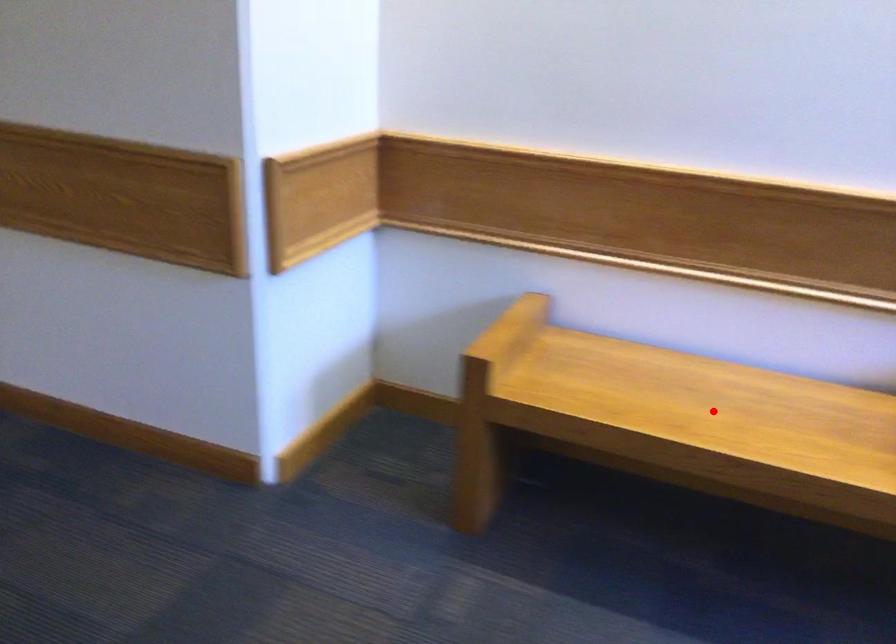
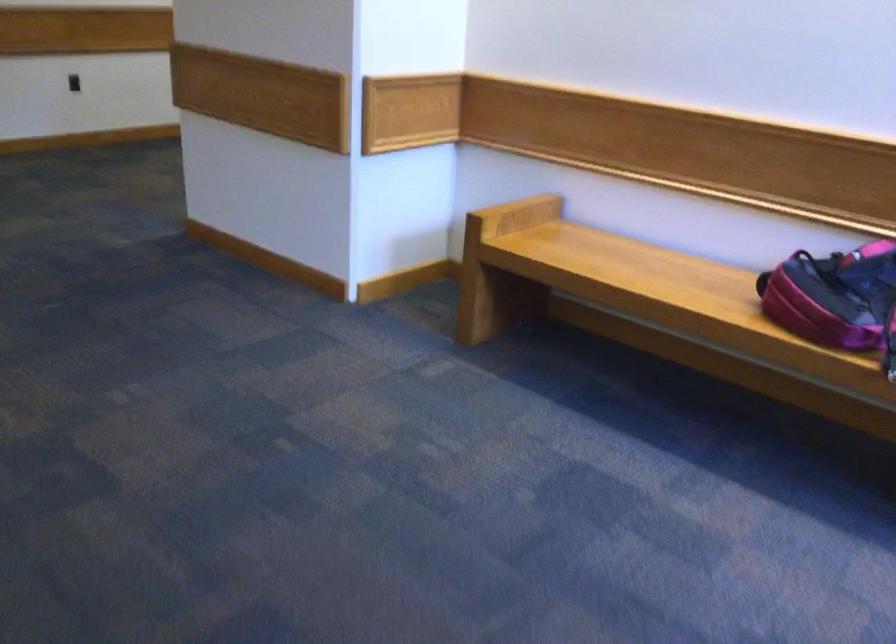
Question: I am providing you with two images of the same scene from different viewpoints. A red point is shown in image1. For the corresponding object point in image2, is it positioned nearer or farther from the camera?

Choices:
 (A) Nearer
 (B) Farther

Answer: (B)